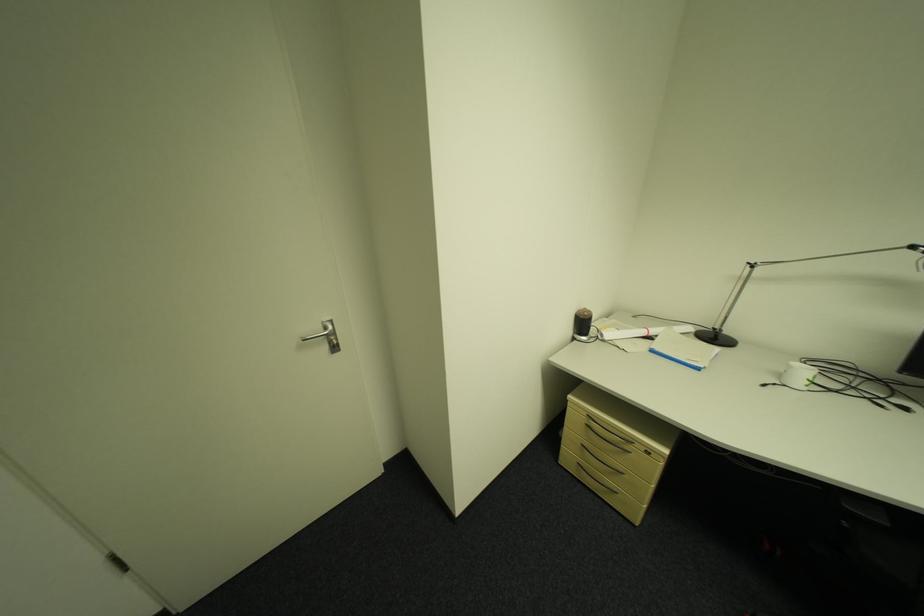
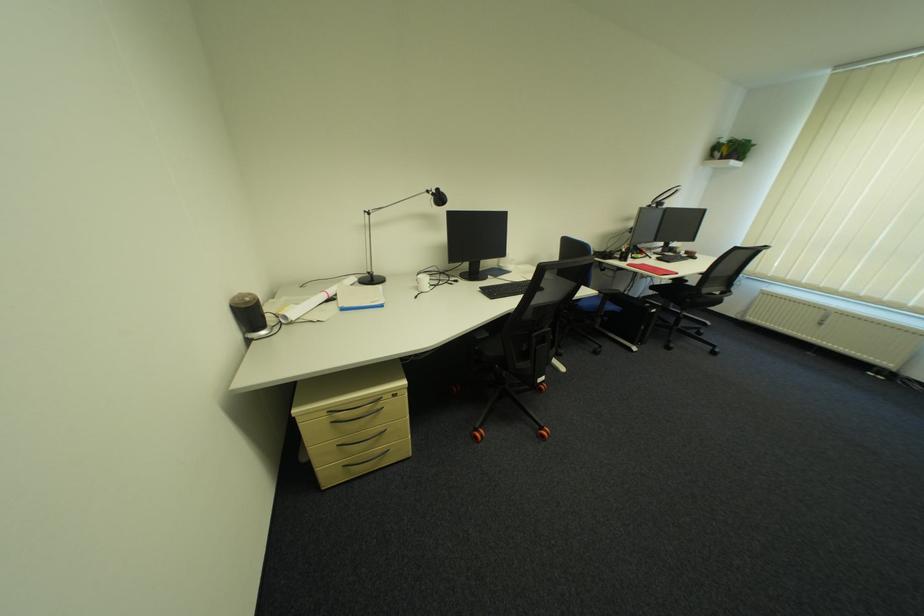
Find the pixel in the second image that matches (896,525) in the first image.

(497, 334)